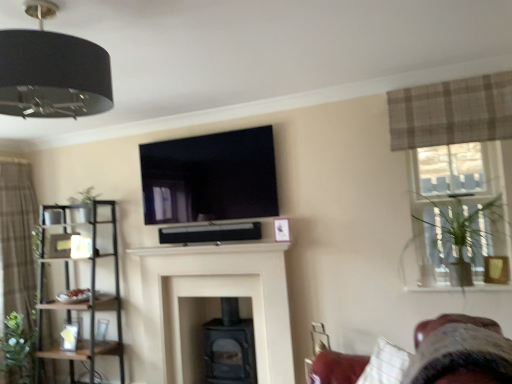
I want to click on vacant area on top of clear glass window at upper right (from a real-world perspective), so click(x=434, y=148).